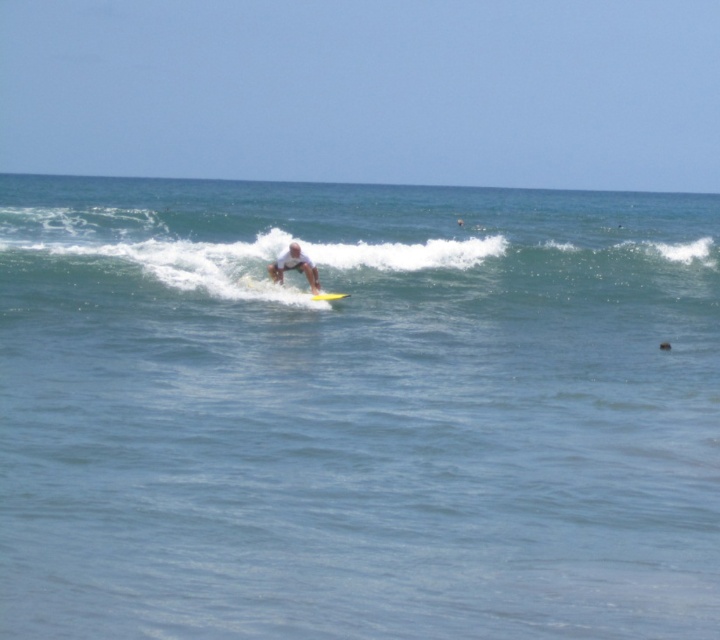
Question: Can you confirm if clear blue water at center is thinner than white matte surfboard at center?

Choices:
 (A) yes
 (B) no

Answer: (B)

Question: Where is clear blue water at center located in relation to white matte surfboard at center in the image?

Choices:
 (A) right
 (B) left

Answer: (A)

Question: Can you confirm if clear blue water at center is smaller than yellow foam surfboard at center?

Choices:
 (A) no
 (B) yes

Answer: (A)

Question: Estimate the real-world distances between objects in this image. Which object is farther from the white matte surfboard at center?

Choices:
 (A) clear blue water at center
 (B) yellow foam surfboard at center

Answer: (A)

Question: Which point is farther to the camera?

Choices:
 (A) [x=454, y=212]
 (B) [x=318, y=296]
 (C) [x=289, y=260]

Answer: (A)

Question: Which of the following is the closest to the observer?

Choices:
 (A) clear blue water at center
 (B) white matte surfboard at center

Answer: (A)